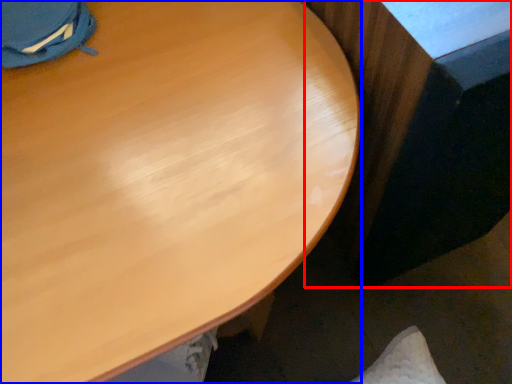
Question: Which object is closer to the camera taking this photo, table (highlighted by a red box) or desk (highlighted by a blue box)?

Choices:
 (A) table
 (B) desk

Answer: (B)